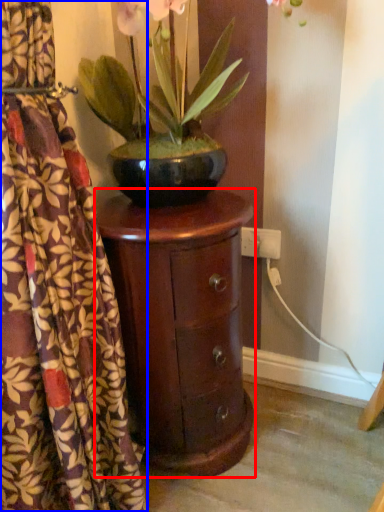
Question: Among these objects, which one is nearest to the camera, nightstand (highlighted by a red box) or curtain (highlighted by a blue box)?

Choices:
 (A) nightstand
 (B) curtain

Answer: (B)